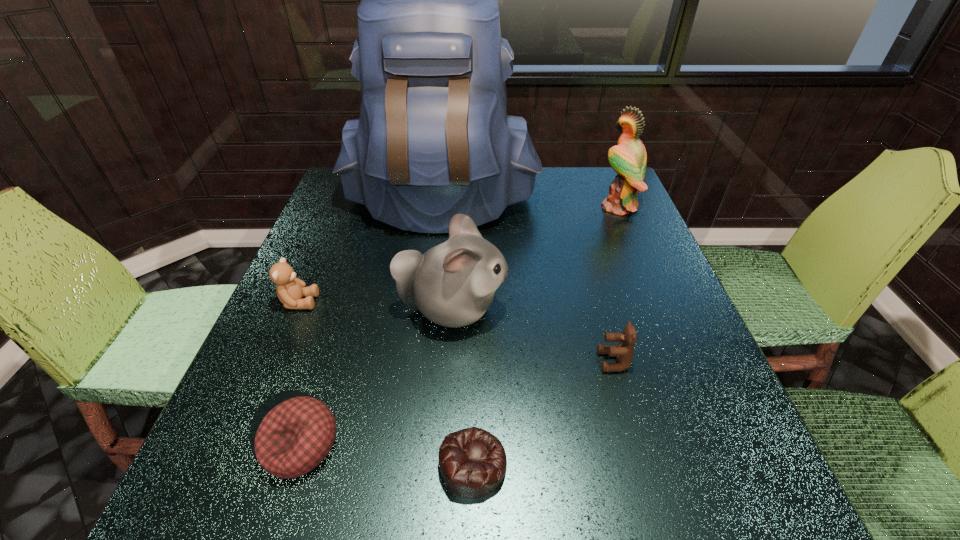
Image resolution: width=960 pixels, height=540 pixels. Identify the location of free space located 0.210m on the right of the sixth tallest object. (468, 444).

This screenshot has width=960, height=540. Identify the location of vacant space located on the right of the right beanbag. (634, 464).

This screenshot has width=960, height=540. I want to click on backpack located in the far edge section of the desktop, so click(x=433, y=139).

Identify the location of parrot situated at the far edge. Image resolution: width=960 pixels, height=540 pixels. 628,158.

Locate an element on the screen. The height and width of the screenshot is (540, 960). backpack that is at the left edge is located at coordinates (433, 139).

Where is `teddy bear present at the left edge`? The width and height of the screenshot is (960, 540). teddy bear present at the left edge is located at coordinates (290, 290).

This screenshot has width=960, height=540. Identify the location of beanbag that is at the left edge. (294, 437).

This screenshot has width=960, height=540. What are the coordinates of `parrot present at the right edge` in the screenshot? It's located at (628, 158).

Where is `teddy bear located in the right edge section of the desktop`? teddy bear located in the right edge section of the desktop is located at coordinates (624, 351).

Locate an element on the screen. The image size is (960, 540). object at the far left corner is located at coordinates (433, 139).